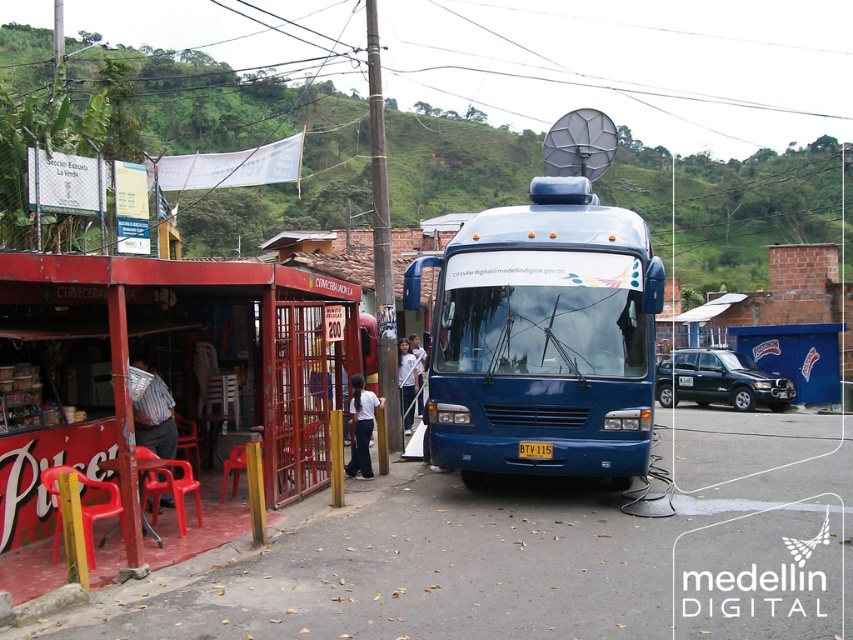
Consider the image. Does matte black food truck at center appear on the left side of white matte shirt at center?

No, matte black food truck at center is not to the left of white matte shirt at center.

Can you confirm if matte black food truck at center is positioned above white matte shirt at center?

Actually, matte black food truck at center is below white matte shirt at center.

Between point (721, 394) and point (402, 356), which one is positioned in front?

Point (402, 356) is more forward.

Identify the location of matte black food truck at center. The height and width of the screenshot is (640, 853). (718, 380).

Between plastic chairs at lower left and matte black food truck at center, which one has more height?

matte black food truck at center is taller.

From the picture: Can you confirm if plastic chairs at lower left is smaller than matte black food truck at center?

Yes, plastic chairs at lower left is smaller than matte black food truck at center.

Measure the distance between point (44,256) and camera.

A distance of 6.71 meters exists between point (44,256) and camera.

Identify the location of plastic chairs at lower left. (167, 365).

Does point (161, 400) lie behind point (410, 429)?

No, it is not.

Based on the photo, between striped fabric shirt at lower left and white matte shirt at center, which one has more height?

white matte shirt at center is taller.

Is point (135, 413) farther from viewer compared to point (398, 349)?

That is False.

This screenshot has width=853, height=640. I want to click on striped fabric shirt at lower left, so click(x=154, y=416).